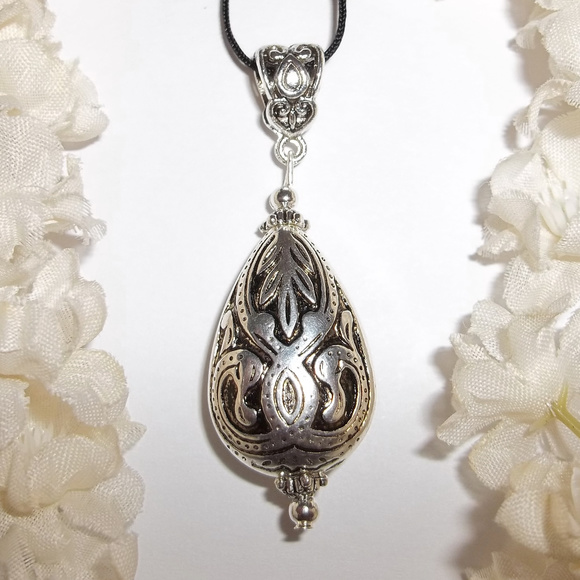
Locate an element on the screen. fake flowers is located at coordinates (563, 49), (549, 171), (527, 340), (522, 496), (72, 487), (64, 415), (46, 317), (30, 184), (26, 28), (29, 82).